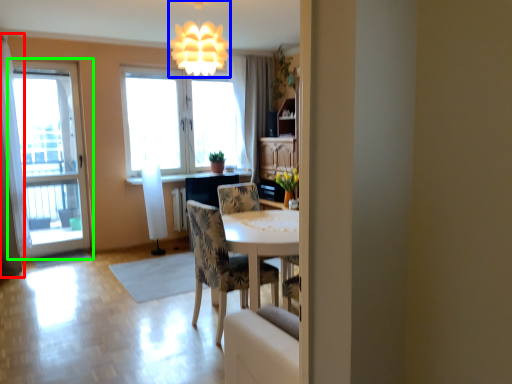
Question: Which object is the closest to the curtain (highlighted by a red box)? Choose among these: fixture (highlighted by a blue box) or window (highlighted by a green box).

Choices:
 (A) fixture
 (B) window

Answer: (B)